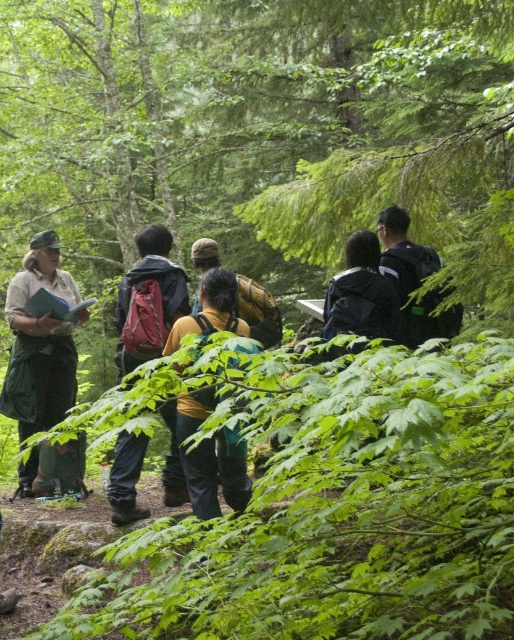
Describe the element at coordinates (40, 342) in the screenshot. I see `green uniform at left` at that location.

Measure the distance between green uniform at left and dark gray backpack at center.

green uniform at left is 7.49 feet away from dark gray backpack at center.

Is point (68, 300) positioned in front of point (362, 333)?

No, it is not.

I want to click on green uniform at left, so click(40, 342).

Which of these two, green uniform at left or yellow fabric backpack at center, stands shorter?

Standing shorter between the two is yellow fabric backpack at center.

Between point (8, 301) and point (194, 410), which one is positioned behind?

Positioned behind is point (8, 301).

The image size is (514, 640). Identify the location of green uniform at left. (40, 342).

Between matte red backpack at center and yellow fabric backpack at center, which one has more height?

With more height is matte red backpack at center.

Who is positioned more to the right, matte red backpack at center or yellow fabric backpack at center?

yellow fabric backpack at center is more to the right.

The height and width of the screenshot is (640, 514). I want to click on matte red backpack at center, so click(x=150, y=298).

Find the location of a particular element. matte red backpack at center is located at coordinates (150, 298).